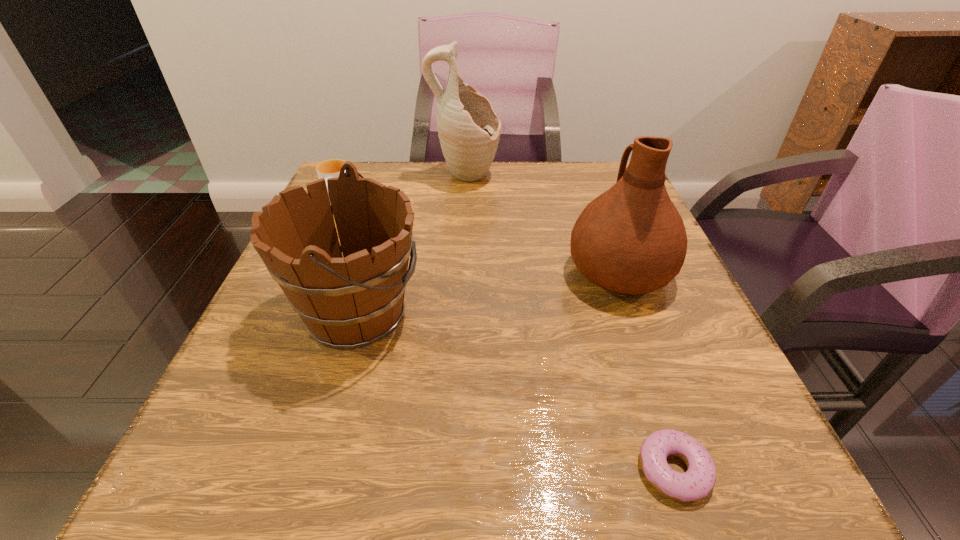
Where is `free space located on the side of the nearer pitcher with the handle`? free space located on the side of the nearer pitcher with the handle is located at coordinates (580, 164).

Identify the location of vacant space situated on the side of the nearer pitcher with the handle. The height and width of the screenshot is (540, 960). (587, 184).

Find the location of a particular element. The height and width of the screenshot is (540, 960). free space located on the side of the nearer pitcher with the handle is located at coordinates (582, 171).

Locate an element on the screen. The height and width of the screenshot is (540, 960). free space located with the handle on the wine bucket is located at coordinates (646, 313).

You are a GUI agent. You are given a task and a screenshot of the screen. Output one action in this format:
    pyautogui.click(x=<x>, y=<y>)
    Task: Click on the vacant space situated 0.290m with the handle on the side of the second farthest object
    Image resolution: width=960 pixels, height=540 pixels.
    Given the screenshot: What is the action you would take?
    pyautogui.click(x=291, y=308)

Where is `free space located on the left of the shortest object`? The width and height of the screenshot is (960, 540). free space located on the left of the shortest object is located at coordinates (592, 469).

Where is `pitcher at the far edge`? pitcher at the far edge is located at coordinates (469, 130).

You are a GUI agent. You are given a task and a screenshot of the screen. Output one action in this format:
    pyautogui.click(x=<x>, y=<y>)
    Task: Click on the cup at the far edge
    Image resolution: width=960 pixels, height=540 pixels.
    Given the screenshot: What is the action you would take?
    pyautogui.click(x=331, y=168)

At what (x,y) coordinates should I click in order to perform the action: click on object at the near edge. Please return your answer as a coordinate pair (x, y). Image resolution: width=960 pixels, height=540 pixels. Looking at the image, I should click on (698, 481).

At what (x,y) coordinates should I click in order to perform the action: click on wine bucket that is at the left edge. Please return your answer as a coordinate pair (x, y). Looking at the image, I should click on (347, 303).